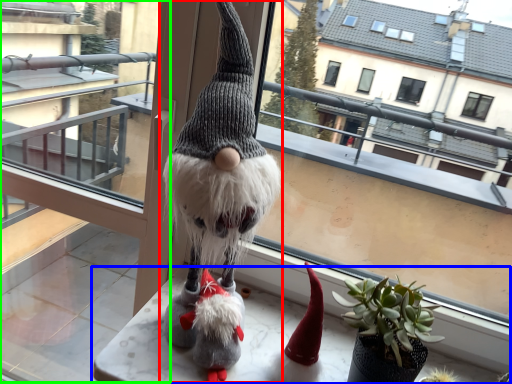
Question: Which object is the farthest from figurine (highlighted by a red box)? Choose among these: table (highlighted by a blue box) or glass door (highlighted by a green box).

Choices:
 (A) table
 (B) glass door

Answer: (B)